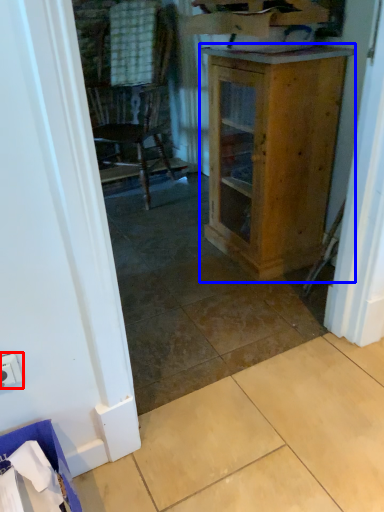
Question: Which object appears closest to the camera in this image, electric outlet (highlighted by a red box) or cabinetry (highlighted by a blue box)?

Choices:
 (A) electric outlet
 (B) cabinetry

Answer: (A)